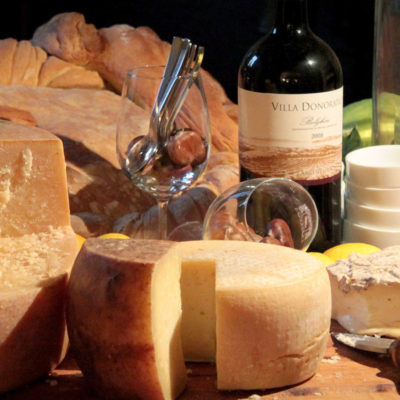
You are a GUI agent. You are given a task and a screenshot of the screen. Output one action in this format:
    pyautogui.click(x=<x>, y=<y>)
    Task: Click on the bowl
    This screenshot has height=400, width=400.
    Given the screenshot: What is the action you would take?
    pyautogui.click(x=383, y=236)